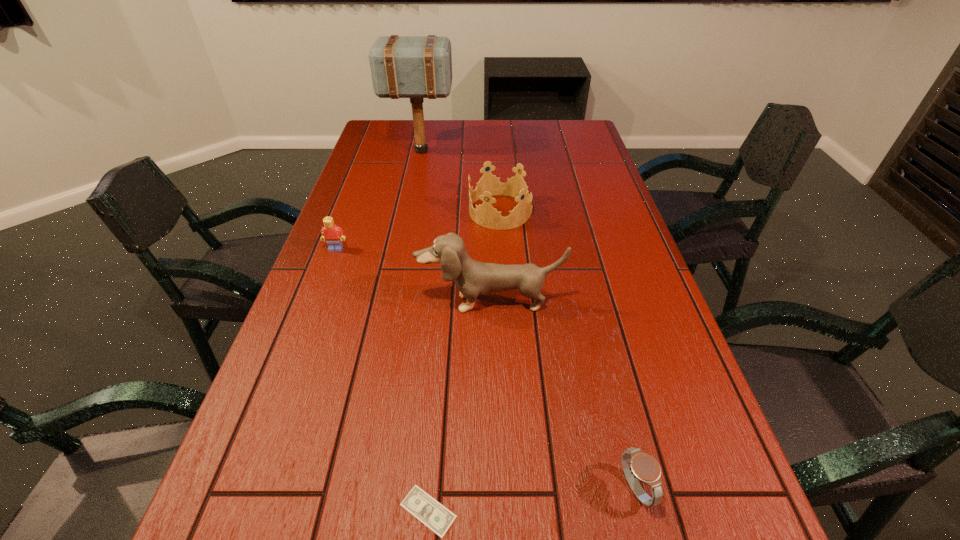
At what (x,y) coordinates should I click in order to perform the action: click on vacant space situated on the striking surface of the mallet. Please return your answer as a coordinate pair (x, y). This screenshot has width=960, height=540. Looking at the image, I should click on [x=494, y=151].

The image size is (960, 540). What are the coordinates of `free region located 0.280m at the face of the second tallest object` in the screenshot? It's located at (493, 426).

Where is `vacant region located 0.110m on the front-facing side of the second farthest object`? This screenshot has width=960, height=540. vacant region located 0.110m on the front-facing side of the second farthest object is located at coordinates (433, 212).

Find the location of a particular element. This screenshot has width=960, height=540. free location located on the front-facing side of the second farthest object is located at coordinates (372, 212).

The image size is (960, 540). I want to click on free space located 0.320m on the front-facing side of the second farthest object, so click(x=365, y=212).

I want to click on free point located on the front-facing side of the third shortest object, so click(320, 293).

Locate an element on the screen. free spot located on the left of the second shortest object is located at coordinates (543, 488).

Image resolution: width=960 pixels, height=540 pixels. What are the coordinates of `free space located on the right of the shortest object` in the screenshot? It's located at (657, 511).

Where is `object that is at the far edge`? This screenshot has height=540, width=960. object that is at the far edge is located at coordinates (416, 67).

This screenshot has height=540, width=960. Identify the location of mallet at the left edge. (416, 67).